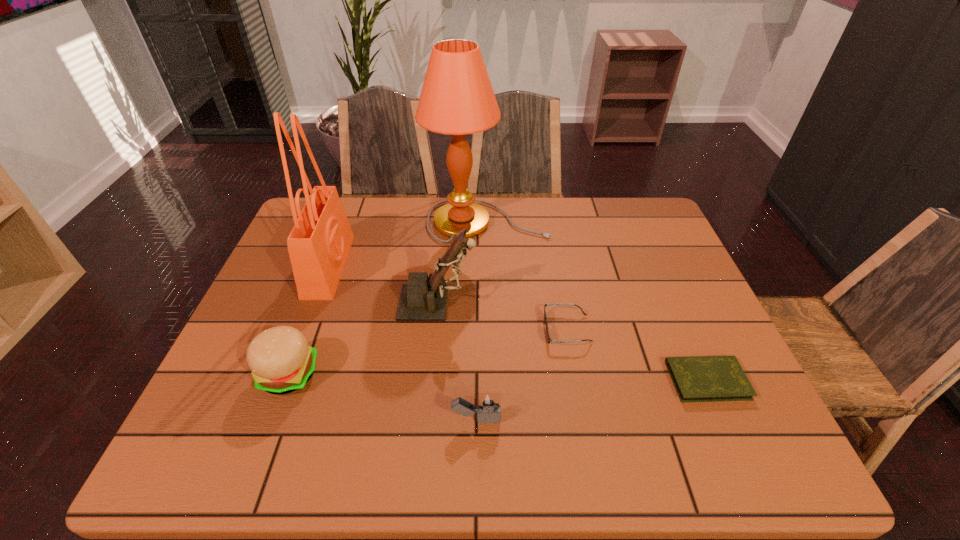
Identify the location of free space located 0.180m on the front-facing side of the fifth shortest object. The width and height of the screenshot is (960, 540). (546, 302).

Find the location of a particular element. This screenshot has height=540, width=960. free space located 0.380m on the back of the hamburger is located at coordinates (336, 248).

Where is `blank space located 0.240m on the right of the nearest object`? This screenshot has height=540, width=960. blank space located 0.240m on the right of the nearest object is located at coordinates (618, 420).

Where is `blank space located 0.250m on the front-facing side of the sunglasses`? This screenshot has height=540, width=960. blank space located 0.250m on the front-facing side of the sunglasses is located at coordinates (442, 329).

Find the location of a particular element. This screenshot has height=540, width=960. free space located on the front-facing side of the sunglasses is located at coordinates (463, 329).

I want to click on vacant space located on the front-facing side of the sunglasses, so click(438, 329).

You are a GUI agent. You are given a task and a screenshot of the screen. Output one action in this format:
    pyautogui.click(x=<x>, y=<y>)
    Task: Click on the vacant space located on the back of the rightmost object
    The height and width of the screenshot is (540, 960).
    Given the screenshot: What is the action you would take?
    pyautogui.click(x=660, y=273)

Locate an element on the screen. The height and width of the screenshot is (540, 960). lamp present at the far edge is located at coordinates (457, 98).

Where is `tote bag at the far edge`? This screenshot has width=960, height=540. tote bag at the far edge is located at coordinates (319, 243).

At what (x,y) coordinates should I click in order to perform the action: click on object positioned at the near edge. Please return your answer as a coordinate pair (x, y). Image resolution: width=960 pixels, height=540 pixels. Looking at the image, I should click on click(x=488, y=405).